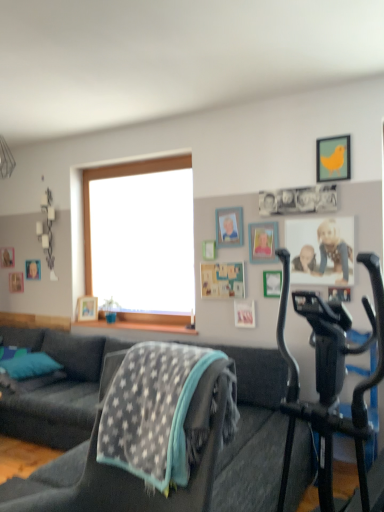
Find the location of a particular element. The image size is (384, 512). yellow matte picture frame at upper right, which ranks as the eighth picture frame in left-to-right order is located at coordinates (333, 158).

Image resolution: width=384 pixels, height=512 pixels. Describe the element at coordinates (263, 242) in the screenshot. I see `wooden picture frame at upper center, marked as the third picture frame in a right-to-left arrangement` at that location.

The image size is (384, 512). Describe the element at coordinates (229, 227) in the screenshot. I see `wooden photo frame at upper center, marked as the 5th picture frame in a right-to-left arrangement` at that location.

Where is `teal fabric pillow at lower left`? Image resolution: width=384 pixels, height=512 pixels. teal fabric pillow at lower left is located at coordinates (29, 365).

Describe the element at coordinates (29, 365) in the screenshot. The image size is (384, 512). I see `teal fabric pillow at lower left` at that location.

Find the location of a particular element. The height and width of the screenshot is (512, 384). wooden picture frame at left, which is the eighth picture frame in right-to-left order is located at coordinates (16, 282).

Identify the location of yellow matte picture frame at upper right, positioned as the first picture frame in front-to-back order. (333, 158).

Considering the relative sizes of wooden picture frame at left, which is counted as the 1th picture frame, starting from the back, and wooden picture frame at upper center, the 6th picture frame from the left, in the image provided, is wooden picture frame at left, which is counted as the 1th picture frame, starting from the back, shorter than wooden picture frame at upper center, the 6th picture frame from the left,?

Correct, wooden picture frame at left, which is counted as the 1th picture frame, starting from the back, is not as tall as wooden picture frame at upper center, the 6th picture frame from the left.

Which of these two, wooden picture frame at left, which appears as the 1th picture frame when viewed from the left, or wooden picture frame at upper center, marked as the sixth picture frame in a back-to-front arrangement, is bigger?

wooden picture frame at upper center, marked as the sixth picture frame in a back-to-front arrangement, is bigger.

Is wooden picture frame at left, positioned as the 8th picture frame in front-to-back order, looking in the opposite direction of wooden picture frame at upper center, the 6th picture frame from the left?

No, wooden picture frame at upper center, the 6th picture frame from the left, is not at the back of wooden picture frame at left, positioned as the 8th picture frame in front-to-back order.

From the image's perspective, would you say wooden picture frame at left, positioned as the 8th picture frame in front-to-back order, is positioned over wooden picture frame at upper center, marked as the sixth picture frame in a back-to-front arrangement?

Incorrect, from the image's perspective, wooden picture frame at left, positioned as the 8th picture frame in front-to-back order, is lower than wooden picture frame at upper center, marked as the sixth picture frame in a back-to-front arrangement.

Are wooden photo frame at upper center, the 4th picture frame in the back-to-front sequence, and dark gray fabric couch at lower left, the second studio couch from the right, far apart?

wooden photo frame at upper center, the 4th picture frame in the back-to-front sequence, is positioned a significant distance from dark gray fabric couch at lower left, the second studio couch from the right.

Considering the relative sizes of wooden photo frame at upper center, the 5th picture frame from the front, and dark gray fabric couch at lower left, the second studio couch from the right, in the image provided, is wooden photo frame at upper center, the 5th picture frame from the front, bigger than dark gray fabric couch at lower left, the second studio couch from the right,?

No, wooden photo frame at upper center, the 5th picture frame from the front, is not bigger than dark gray fabric couch at lower left, the second studio couch from the right.

Which is more to the left, wooden photo frame at upper center, positioned as the 4th picture frame in left-to-right order, or dark gray fabric couch at lower left, the second studio couch from the right?

From the viewer's perspective, dark gray fabric couch at lower left, the second studio couch from the right, appears more on the left side.

Does wooden photo frame at upper center, marked as the 5th picture frame in a right-to-left arrangement, contain dark gray fabric couch at lower left, which ranks as the 1th studio couch in left-to-right order?

No, dark gray fabric couch at lower left, which ranks as the 1th studio couch in left-to-right order, is located outside of wooden photo frame at upper center, marked as the 5th picture frame in a right-to-left arrangement.

Considering the relative positions of wooden picture frame at upper right, the 4th picture frame positioned from the right, and black matte stationary bicycle at right in the image provided, is wooden picture frame at upper right, the 4th picture frame positioned from the right, to the left or to the right of black matte stationary bicycle at right?

Based on their positions, wooden picture frame at upper right, the 4th picture frame positioned from the right, is located to the left of black matte stationary bicycle at right.

Is wooden picture frame at upper right, the 5th picture frame from the left, turned away from black matte stationary bicycle at right?

No, wooden picture frame at upper right, the 5th picture frame from the left,'s orientation is not away from black matte stationary bicycle at right.

From their relative heights in the image, would you say wooden picture frame at upper right, the 5th picture frame from the left, is taller or shorter than black matte stationary bicycle at right?

In the image, wooden picture frame at upper right, the 5th picture frame from the left, appears to be shorter than black matte stationary bicycle at right.

Between wooden picture frame at upper right, which is counted as the fifth picture frame, starting from the back, and black matte stationary bicycle at right, which one has larger width?

black matte stationary bicycle at right.

Is wooden picture frame at left, positioned as the 8th picture frame in front-to-back order, oriented towards wooden picture frame at upper right, the 4th picture frame viewed from the front?

No, wooden picture frame at left, positioned as the 8th picture frame in front-to-back order, is not turned towards wooden picture frame at upper right, the 4th picture frame viewed from the front.

Where is `picture frame that is the 4th object to the left of the wooden picture frame at upper right, the 5th picture frame from the left, starting at the anchor`? The image size is (384, 512). picture frame that is the 4th object to the left of the wooden picture frame at upper right, the 5th picture frame from the left, starting at the anchor is located at coordinates point(16,282).

Which point is more forward, (13, 277) or (241, 304)?

The point (241, 304) is closer.

Is wooden picture frame at left, which is the eighth picture frame in right-to-left order, wider than wooden picture frame at upper right, the 4th picture frame positioned from the right?

Incorrect, the width of wooden picture frame at left, which is the eighth picture frame in right-to-left order, does not surpass that of wooden picture frame at upper right, the 4th picture frame positioned from the right.

Is wooden picture frame at upper center, marked as the third picture frame in a right-to-left arrangement, facing towards wooden picture frame at lower left, which ranks as the 3th picture frame in left-to-right order?

No, wooden picture frame at upper center, marked as the third picture frame in a right-to-left arrangement, is not facing towards wooden picture frame at lower left, which ranks as the 3th picture frame in left-to-right order.

Is wooden picture frame at upper center, marked as the third picture frame in a right-to-left arrangement, situated inside wooden picture frame at lower left, which appears as the 3th picture frame when viewed from the back, or outside?

wooden picture frame at upper center, marked as the third picture frame in a right-to-left arrangement, exists outside the volume of wooden picture frame at lower left, which appears as the 3th picture frame when viewed from the back.

Is wooden picture frame at upper center, marked as the third picture frame in a right-to-left arrangement, shorter than wooden picture frame at lower left, which appears as the 3th picture frame when viewed from the back?

No, wooden picture frame at upper center, marked as the third picture frame in a right-to-left arrangement, is not shorter than wooden picture frame at lower left, which appears as the 3th picture frame when viewed from the back.

Looking at this image, is wooden picture frame at upper center, the 6th picture frame from the left, next to wooden picture frame at lower left, which is the 6th picture frame from front to back?

No, wooden picture frame at upper center, the 6th picture frame from the left, is not in contact with wooden picture frame at lower left, which is the 6th picture frame from front to back.

Is black matte stationary bicycle at right facing towards wooden picture frame at left, which appears as the 1th picture frame when viewed from the left?

No, black matte stationary bicycle at right is not facing towards wooden picture frame at left, which appears as the 1th picture frame when viewed from the left.

Is black matte stationary bicycle at right inside or outside of wooden picture frame at left, which is the eighth picture frame in right-to-left order?

black matte stationary bicycle at right is not enclosed by wooden picture frame at left, which is the eighth picture frame in right-to-left order.

From the image's perspective, which one is positioned lower, black matte stationary bicycle at right or wooden picture frame at left, which is the eighth picture frame in right-to-left order?

black matte stationary bicycle at right.

This screenshot has width=384, height=512. I want to click on stationary bicycle on the right side of wooden picture frame at left, which is the eighth picture frame in right-to-left order, so click(x=330, y=377).

Is wooden photo frame at upper left, acting as the seventh picture frame starting from the right, far away from wooden picture frame at lower left, marked as the 6th picture frame in a right-to-left arrangement?

That's not correct — wooden photo frame at upper left, acting as the seventh picture frame starting from the right, is a little close to wooden picture frame at lower left, marked as the 6th picture frame in a right-to-left arrangement.

Looking at this image, from a real-world perspective, which object stands above the other?

In real-world perspective, wooden photo frame at upper left, positioned as the second picture frame in left-to-right order, is above.

Who is more distant, wooden photo frame at upper left, positioned as the seventh picture frame in front-to-back order, or wooden picture frame at lower left, which ranks as the 3th picture frame in left-to-right order?

wooden photo frame at upper left, positioned as the seventh picture frame in front-to-back order.

This screenshot has height=512, width=384. What are the coordinates of `picture frame that is the 5th one when counting forward from the wooden picture frame at left, which is the eighth picture frame in right-to-left order` in the screenshot? It's located at (263, 242).

From the image's perspective, count 2nd studio couchs downward from the wooden photo frame at upper center, the 4th picture frame in the back-to-front sequence, and point to it. Please provide its 2D coordinates.

[(57, 389)]

Looking at the image, which one is located further to wooden picture frame at lower left, which is the 6th picture frame from front to back, black matte stationary bicycle at right or wooden picture frame at upper center, the 6th picture frame from the left?

black matte stationary bicycle at right is positioned further to the anchor wooden picture frame at lower left, which is the 6th picture frame from front to back.

Based on their spatial positions, is wooden picture frame at upper right, the 4th picture frame viewed from the front, or teal fabric pillow at lower left closer to yellow matte picture frame at upper right, marked as the 8th picture frame in a back-to-front arrangement?

wooden picture frame at upper right, the 4th picture frame viewed from the front.

Which object lies nearer to the anchor point wooden picture frame at lower left, which is the 6th picture frame from front to back, wooden photo frame at upper center, the 4th picture frame in the back-to-front sequence, or wooden photo frame at upper left, positioned as the second picture frame in left-to-right order?

Among the two, wooden photo frame at upper left, positioned as the second picture frame in left-to-right order, is located nearer to wooden picture frame at lower left, which is the 6th picture frame from front to back.

Estimate the real-world distances between objects in this image. Which object is closer to teal fabric pillow at lower left, wooden photo frame at upper center, the 4th picture frame in the back-to-front sequence, or wooden picture frame at upper right, the 4th picture frame viewed from the front?

wooden picture frame at upper right, the 4th picture frame viewed from the front.

Looking at the image, which one is located closer to metallic silver picture frame at center, placed as the 2th picture frame when sorted from right to left, teal fabric pillow at lower left or yellow matte picture frame at upper right, which ranks as the eighth picture frame in left-to-right order?

yellow matte picture frame at upper right, which ranks as the eighth picture frame in left-to-right order, lies closer to metallic silver picture frame at center, placed as the 2th picture frame when sorted from right to left, than the other object.

Based on their spatial positions, is dark gray fabric couch at lower left, the second studio couch from the right, or metallic silver picture frame at center, acting as the 2th picture frame starting from the front, further from wooden picture frame at left, which appears as the 1th picture frame when viewed from the left?

Based on the image, metallic silver picture frame at center, acting as the 2th picture frame starting from the front, appears to be further to wooden picture frame at left, which appears as the 1th picture frame when viewed from the left.

Which object lies nearer to the anchor point yellow matte picture frame at upper right, marked as the 8th picture frame in a back-to-front arrangement, wooden picture frame at upper center, the 6th picture frame from the left, or wooden picture frame at lower left, marked as the 6th picture frame in a right-to-left arrangement?

Based on the image, wooden picture frame at upper center, the 6th picture frame from the left, appears to be nearer to yellow matte picture frame at upper right, marked as the 8th picture frame in a back-to-front arrangement.

When comparing their distances from dark gray fabric couch at lower left, the second studio couch from the right, does wooden picture frame at upper center, the 6th picture frame from the left, or black matte stationary bicycle at right seem closer?

wooden picture frame at upper center, the 6th picture frame from the left, is positioned closer to the anchor dark gray fabric couch at lower left, the second studio couch from the right.

The height and width of the screenshot is (512, 384). I want to click on pillow located between dark gray fabric couch at center, the first studio couch positioned from the right, and wooden picture frame at left, which is counted as the 1th picture frame, starting from the back, in the depth direction, so click(x=29, y=365).

This screenshot has height=512, width=384. In order to click on pillow between black matte stationary bicycle at right and wooden picture frame at left, which is the eighth picture frame in right-to-left order, along the z-axis in this screenshot , I will do `click(29, 365)`.

Where is `picture frame situated between dark gray fabric couch at lower left, the second studio couch from the right, and wooden picture frame at upper right, the 4th picture frame viewed from the front, from left to right`? The image size is (384, 512). picture frame situated between dark gray fabric couch at lower left, the second studio couch from the right, and wooden picture frame at upper right, the 4th picture frame viewed from the front, from left to right is located at coordinates (229, 227).

Where is `studio couch positioned between dark gray fabric couch at center, which is the second studio couch from left to right, and wooden picture frame at upper right, the 4th picture frame positioned from the right, from near to far`? studio couch positioned between dark gray fabric couch at center, which is the second studio couch from left to right, and wooden picture frame at upper right, the 4th picture frame positioned from the right, from near to far is located at coordinates [57, 389].